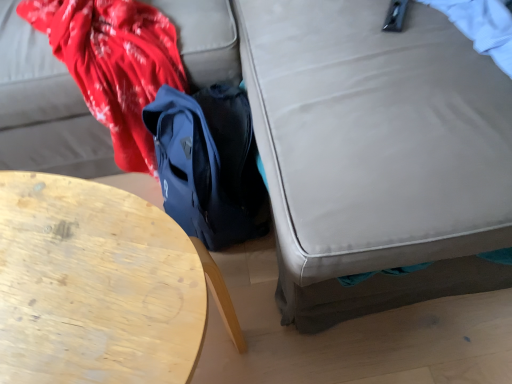
Identify the location of blank space above wooden table at lower left (from a real-world perspective). (74, 260).